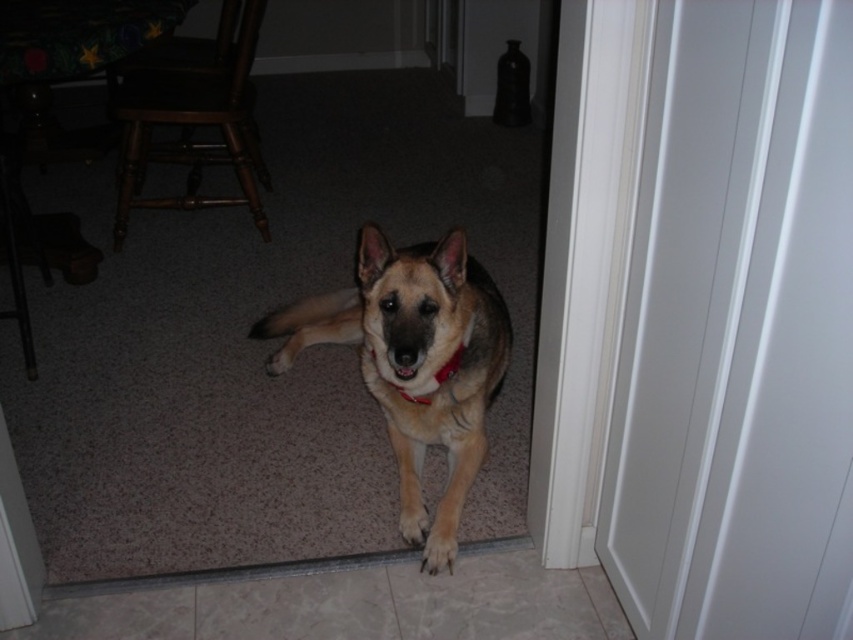
Question: Can you confirm if white smooth door at center right is positioned below light brown fur at center?

Choices:
 (A) yes
 (B) no

Answer: (B)

Question: Is white smooth door at center right in front of brown fur paw at lower center?

Choices:
 (A) no
 (B) yes

Answer: (B)

Question: Which is farther from the white smooth door at center right?

Choices:
 (A) light brown fur at center
 (B) brown fur paw at lower center
 (C) golden fur dog at center

Answer: (B)

Question: Which point is closer to the camera?

Choices:
 (A) (431, 572)
 (B) (418, 522)
 (C) (415, 316)

Answer: (C)

Question: Which object is the closest to the brown fur paw at lower center?

Choices:
 (A) white smooth door at center right
 (B) golden fur dog at center
 (C) red fabric neckband at center

Answer: (C)

Question: Does golden fur dog at center have a smaller size compared to red fabric neckband at center?

Choices:
 (A) no
 (B) yes

Answer: (A)